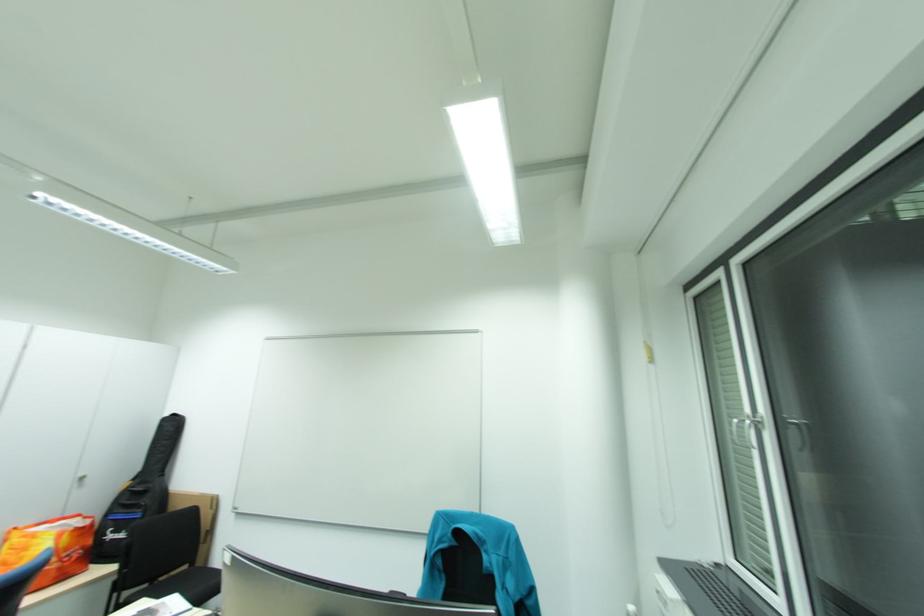
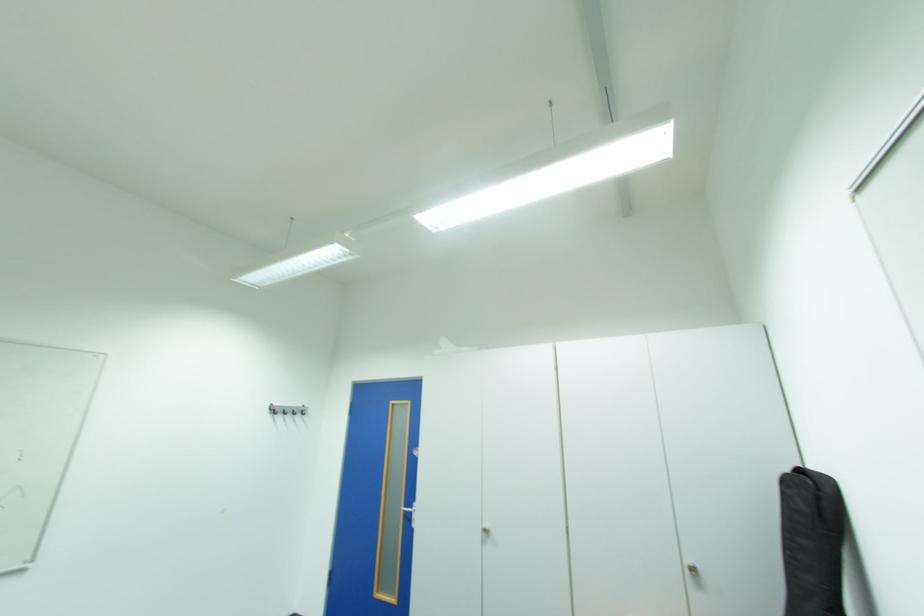
In the second image, find the point that corresponds to pixel 86 480 in the first image.

(697, 570)